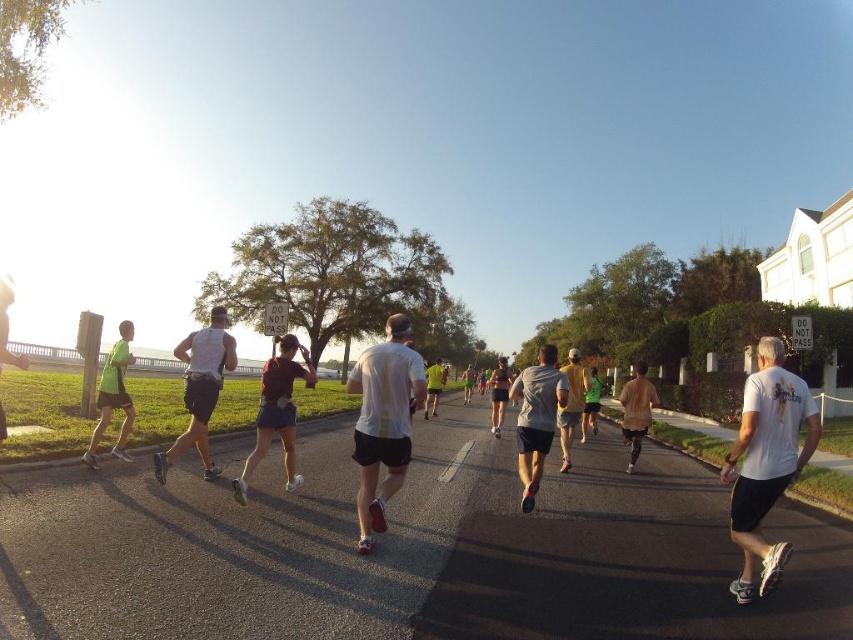
You are a photographer standing at the starting line of the marathon. You want to take a photo that includes both the point at coordinates point (225,310) and point (296,486). Which point should you focus on first to ensure both are in the frame?

You should focus on point (225,310) first because it is closer to you than point (296,486), so adjusting the camera to include both points will require framing from the closer point outward.

You are a photographer at the marathon event. You want to take a photo that includes both the white matte shirt at center and the yellow fabric shirt at center. Which of the two shirts should you focus on to ensure the subject is larger in the frame?

The white matte shirt at center is bigger than the yellow fabric shirt at center, so you should focus on the white matte shirt at center to ensure the subject is larger in the frame.

You are a photographer at the marathon event and want to capture a photo of both the white matte shirt at center and the yellow fabric shirt at center in the same frame. Based on their positions, which runner should be positioned to the left in the photo?

The white matte shirt at center should be positioned to the left in the photo because it is already to the left of the yellow fabric shirt at center in the scene.